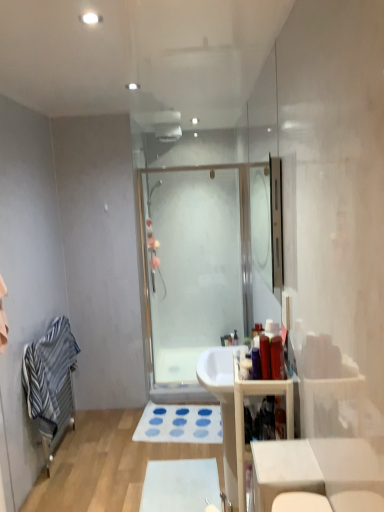
Question: From the image's perspective, does wooden cabinet at right appear lower than clear glass mirror at upper center?

Choices:
 (A) no
 (B) yes

Answer: (B)

Question: Would you say wooden cabinet at right contains clear glass mirror at upper center?

Choices:
 (A) yes
 (B) no

Answer: (B)

Question: From the image's perspective, would you say wooden cabinet at right is positioned over clear glass mirror at upper center?

Choices:
 (A) no
 (B) yes

Answer: (A)

Question: Considering the relative positions of wooden cabinet at right and clear glass mirror at upper center in the image provided, is wooden cabinet at right to the right of clear glass mirror at upper center from the viewer's perspective?

Choices:
 (A) yes
 (B) no

Answer: (B)

Question: Are wooden cabinet at right and clear glass mirror at upper center located far from each other?

Choices:
 (A) no
 (B) yes

Answer: (B)

Question: Relative to blue fabric bath mat at lower center, the 1th bath mat when ordered from top to bottom, is clear glass mirror at upper center in front or behind?

Choices:
 (A) behind
 (B) front

Answer: (B)

Question: Is point (276, 201) positioned closer to the camera than point (147, 437)?

Choices:
 (A) closer
 (B) farther

Answer: (A)

Question: Which is correct: clear glass mirror at upper center is inside blue fabric bath mat at lower center, arranged as the first bath mat when viewed from the back, or outside of it?

Choices:
 (A) outside
 (B) inside

Answer: (A)

Question: From a real-world perspective, is clear glass mirror at upper center positioned above or below blue fabric bath mat at lower center, arranged as the second bath mat when viewed from the front?

Choices:
 (A) above
 (B) below

Answer: (A)

Question: Would you say blue fabric bath mat at lower center, arranged as the first bath mat when viewed from the back, is inside or outside striped cotton bath towel at left?

Choices:
 (A) outside
 (B) inside

Answer: (A)

Question: From the image's perspective, is blue fabric bath mat at lower center, the 1th bath mat when ordered from top to bottom, positioned above or below striped cotton bath towel at left?

Choices:
 (A) below
 (B) above

Answer: (A)

Question: In the image, is blue fabric bath mat at lower center, arranged as the first bath mat when viewed from the back, positioned in front of or behind striped cotton bath towel at left?

Choices:
 (A) front
 (B) behind

Answer: (B)

Question: Based on their sizes in the image, would you say blue fabric bath mat at lower center, arranged as the first bath mat when viewed from the back, is bigger or smaller than striped cotton bath towel at left?

Choices:
 (A) small
 (B) big

Answer: (A)

Question: Considering the positions of blue fabric bath mat at lower center, arranged as the first bath mat when viewed from the back, and white matte bath mat at lower center, the second bath mat in the back-to-front sequence, in the image, is blue fabric bath mat at lower center, arranged as the first bath mat when viewed from the back, taller or shorter than white matte bath mat at lower center, the second bath mat in the back-to-front sequence,?

Choices:
 (A) short
 (B) tall

Answer: (B)

Question: Looking at their shapes, would you say blue fabric bath mat at lower center, arranged as the second bath mat when viewed from the front, is wider or thinner than white matte bath mat at lower center, the second bath mat in the back-to-front sequence?

Choices:
 (A) wide
 (B) thin

Answer: (A)